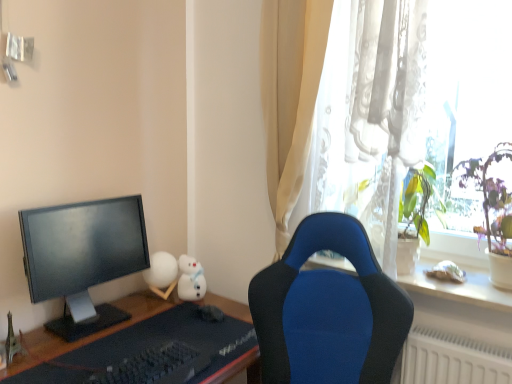
The image size is (512, 384). I want to click on free location in front of white matte sphere at center-left, placed as the 3th toy when sorted from right to left, so click(x=134, y=306).